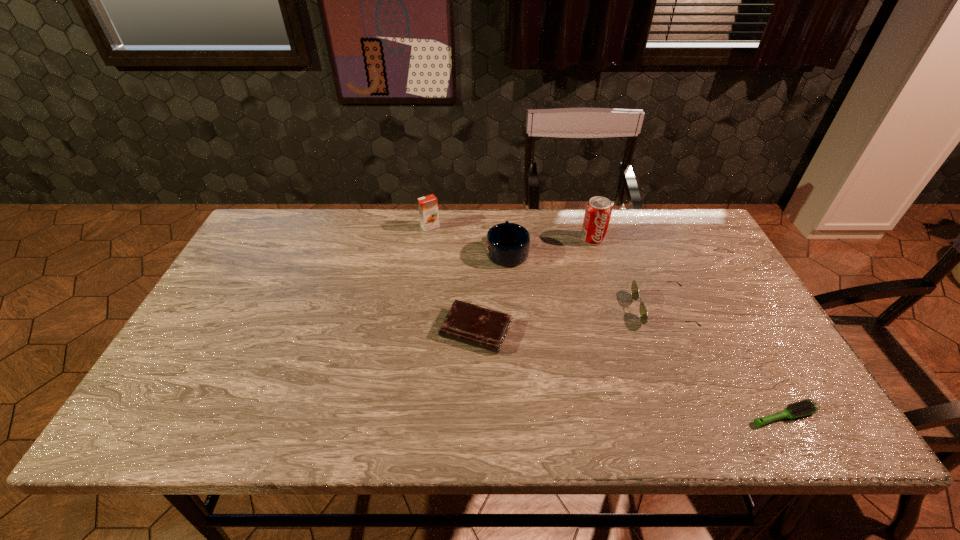
At what (x,y) coordinates should I click in order to perform the action: click on vacant space that is in between the soda can and the sunglasses. Please return your answer as a coordinate pair (x, y). The image size is (960, 540). Looking at the image, I should click on (628, 274).

At what (x,y) coordinates should I click in order to perform the action: click on free space between the second object from right to left and the fourth object from left to right. Please return your answer as a coordinate pair (x, y). The height and width of the screenshot is (540, 960). Looking at the image, I should click on (628, 274).

Identify which object is located as the nearest to the orange juice. Please provide its 2D coordinates. Your answer should be formatted as a tuple, i.e. [(x, y)], where the tuple contains the x and y coordinates of a point satisfying the conditions above.

[(507, 244)]

Select which object appears as the closest to the nearest object. Please provide its 2D coordinates. Your answer should be formatted as a tuple, i.e. [(x, y)], where the tuple contains the x and y coordinates of a point satisfying the conditions above.

[(634, 288)]

The width and height of the screenshot is (960, 540). I want to click on free spot that satisfies the following two spatial constraints: 1. on the front side of the tallest object; 2. on the left side of the orange juice, so click(x=428, y=239).

I want to click on vacant space that satisfies the following two spatial constraints: 1. with the handle on the side of the tallest object; 2. on the left side of the mug, so click(x=506, y=239).

At what (x,y) coordinates should I click in order to perform the action: click on free spot that satisfies the following two spatial constraints: 1. on the front side of the shortest object; 2. on the left side of the diary. Please return your answer as a coordinate pair (x, y). This screenshot has width=960, height=540. Looking at the image, I should click on (475, 416).